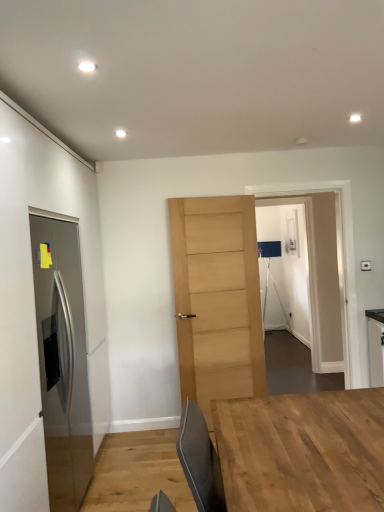
Locate an element on the screen. This screenshot has width=384, height=512. stainless steel door at left, positioned as the 2th door in right-to-left order is located at coordinates (62, 361).

Describe the element at coordinates (62, 361) in the screenshot. I see `stainless steel door at left, positioned as the 2th door in right-to-left order` at that location.

I want to click on transparent glass door at center, marked as the 1th glass door in a back-to-front arrangement, so click(x=286, y=269).

Locate an element on the screen. Image resolution: width=384 pixels, height=512 pixels. light wood door at center, the 2th door when ordered from front to back is located at coordinates (217, 298).

This screenshot has width=384, height=512. I want to click on transparent glass door at center, acting as the 1th glass door starting from the front, so click(324, 278).

Locate an element on the screen. Image resolution: width=384 pixels, height=512 pixels. natural wood table at center is located at coordinates (302, 451).

From the picture: Considering the positions of objects transparent glass door at center, marked as the second glass door in a back-to-front arrangement, and light wood door at center, the 2th door when ordered from front to back, in the image provided, who is behind, transparent glass door at center, marked as the second glass door in a back-to-front arrangement, or light wood door at center, the 2th door when ordered from front to back,?

transparent glass door at center, marked as the second glass door in a back-to-front arrangement, is more distant.

Is transparent glass door at center, marked as the second glass door in a back-to-front arrangement, positioned with its back to light wood door at center, marked as the 1th door in a right-to-left arrangement?

That's not correct — transparent glass door at center, marked as the second glass door in a back-to-front arrangement, is not looking away from light wood door at center, marked as the 1th door in a right-to-left arrangement.

Is light wood door at center, the 2th door when ordered from front to back, surrounded by transparent glass door at center, marked as the second glass door in a back-to-front arrangement?

No, light wood door at center, the 2th door when ordered from front to back, is not a part of transparent glass door at center, marked as the second glass door in a back-to-front arrangement.

Which is more to the left, natural wood table at center or transparent glass door at center, marked as the 1th glass door in a back-to-front arrangement?

From the viewer's perspective, natural wood table at center appears more on the left side.

Is natural wood table at center spatially inside transparent glass door at center, marked as the 1th glass door in a back-to-front arrangement, or outside of it?

natural wood table at center is not inside transparent glass door at center, marked as the 1th glass door in a back-to-front arrangement, it's outside.

Considering the positions of objects natural wood table at center and transparent glass door at center, acting as the second glass door starting from the front, in the image provided, who is behind, natural wood table at center or transparent glass door at center, acting as the second glass door starting from the front,?

transparent glass door at center, acting as the second glass door starting from the front, is further away from the camera.

Is natural wood table at center not close to transparent glass door at center, marked as the 1th glass door in a back-to-front arrangement?

Yes, natural wood table at center and transparent glass door at center, marked as the 1th glass door in a back-to-front arrangement, are quite far apart.

Which of these two, light wood door at center, which is the 1th door from back to front, or natural wood table at center, is thinner?

light wood door at center, which is the 1th door from back to front.

Is point (182, 401) behind point (330, 500)?

Yes.

Is light wood door at center, which is counted as the 2th door, starting from the left, positioned with its back to natural wood table at center?

No, light wood door at center, which is counted as the 2th door, starting from the left, is not facing the opposite direction of natural wood table at center.

Consider the image. Can you tell me how much stainless steel door at left, arranged as the second door when viewed from the back, and natural wood table at center differ in facing direction?

stainless steel door at left, arranged as the second door when viewed from the back, and natural wood table at center are facing 3.29 degrees away from each other.

From a real-world perspective, is stainless steel door at left, positioned as the 2th door in right-to-left order, located higher than natural wood table at center?

Yes.

Considering the sizes of stainless steel door at left, positioned as the 2th door in right-to-left order, and natural wood table at center in the image, is stainless steel door at left, positioned as the 2th door in right-to-left order, taller or shorter than natural wood table at center?

Considering their sizes, stainless steel door at left, positioned as the 2th door in right-to-left order, has more height than natural wood table at center.

Are stainless steel door at left, positioned as the 2th door in right-to-left order, and natural wood table at center beside each other?

No, stainless steel door at left, positioned as the 2th door in right-to-left order, is not with natural wood table at center.

From the image's perspective, does light wood door at center, which is counted as the 2th door, starting from the left, appear higher than transparent glass door at center, acting as the second glass door starting from the front?

No, from the image's perspective, light wood door at center, which is counted as the 2th door, starting from the left, is not over transparent glass door at center, acting as the second glass door starting from the front.

From a real-world perspective, between light wood door at center, which is counted as the 2th door, starting from the left, and transparent glass door at center, marked as the 1th glass door in a back-to-front arrangement, who is vertically lower?

In real-world perspective, transparent glass door at center, marked as the 1th glass door in a back-to-front arrangement, is lower.

How much distance is there between light wood door at center, which is counted as the 2th door, starting from the left, and transparent glass door at center, acting as the second glass door starting from the front?

light wood door at center, which is counted as the 2th door, starting from the left, is 7.96 feet from transparent glass door at center, acting as the second glass door starting from the front.

Is light wood door at center, which is the 1th door from back to front, not close to transparent glass door at center, acting as the second glass door starting from the front?

Yes, light wood door at center, which is the 1th door from back to front, is far from transparent glass door at center, acting as the second glass door starting from the front.

From the image's perspective, is transparent glass door at center, marked as the 1th glass door in a back-to-front arrangement, located above transparent glass door at center, marked as the second glass door in a back-to-front arrangement?

No, from the image's perspective, transparent glass door at center, marked as the 1th glass door in a back-to-front arrangement, is not above transparent glass door at center, marked as the second glass door in a back-to-front arrangement.

Consider the image. Is transparent glass door at center, marked as the 1th glass door in a back-to-front arrangement, placed right next to transparent glass door at center, acting as the 1th glass door starting from the front?

There is a gap between transparent glass door at center, marked as the 1th glass door in a back-to-front arrangement, and transparent glass door at center, acting as the 1th glass door starting from the front.

Considering the positions of objects transparent glass door at center, marked as the 1th glass door in a back-to-front arrangement, and transparent glass door at center, acting as the 1th glass door starting from the front, in the image provided, who is in front, transparent glass door at center, marked as the 1th glass door in a back-to-front arrangement, or transparent glass door at center, acting as the 1th glass door starting from the front,?

Positioned in front is transparent glass door at center, acting as the 1th glass door starting from the front.

In the image, is natural wood table at center positioned in front of or behind transparent glass door at center, acting as the 1th glass door starting from the front?

Result: Visually, natural wood table at center is located in front of transparent glass door at center, acting as the 1th glass door starting from the front.

Does natural wood table at center have a greater height compared to transparent glass door at center, acting as the 1th glass door starting from the front?

No, natural wood table at center is not taller than transparent glass door at center, acting as the 1th glass door starting from the front.

Are natural wood table at center and transparent glass door at center, acting as the 1th glass door starting from the front, located far from each other?

That's right, there is a large distance between natural wood table at center and transparent glass door at center, acting as the 1th glass door starting from the front.

The height and width of the screenshot is (512, 384). Find the location of `glass door that is the 2nd object located above the natural wood table at center (from the image's perspective)`. glass door that is the 2nd object located above the natural wood table at center (from the image's perspective) is located at coordinates (324, 278).

From a real-world perspective, starting from the transparent glass door at center, marked as the second glass door in a back-to-front arrangement, which door is the 1st one below it? Please provide its 2D coordinates.

[(217, 298)]

Identify the location of table on the left of transparent glass door at center, acting as the second glass door starting from the front. Image resolution: width=384 pixels, height=512 pixels. (302, 451).

Looking at the image, which one is located further to stainless steel door at left, arranged as the second door when viewed from the back, natural wood table at center or transparent glass door at center, marked as the second glass door in a back-to-front arrangement?

transparent glass door at center, marked as the second glass door in a back-to-front arrangement, lies further to stainless steel door at left, arranged as the second door when viewed from the back, than the other object.

Considering their positions, is natural wood table at center positioned closer to light wood door at center, the 2th door when ordered from front to back, than transparent glass door at center, acting as the second glass door starting from the front?

natural wood table at center is positioned closer to the anchor light wood door at center, the 2th door when ordered from front to back.

When comparing their distances from stainless steel door at left, arranged as the second door when viewed from the back, does transparent glass door at center, acting as the second glass door starting from the front, or natural wood table at center seem closer?

natural wood table at center is closer to stainless steel door at left, arranged as the second door when viewed from the back.

Looking at the image, which one is located further to natural wood table at center, stainless steel door at left, arranged as the second door when viewed from the back, or transparent glass door at center, marked as the second glass door in a back-to-front arrangement?

transparent glass door at center, marked as the second glass door in a back-to-front arrangement.

Considering their positions, is natural wood table at center positioned further to light wood door at center, which is the 1th door from back to front, than stainless steel door at left, positioned as the 2th door in right-to-left order?

natural wood table at center is positioned further to the anchor light wood door at center, which is the 1th door from back to front.

From the image, which object appears to be farther from natural wood table at center, transparent glass door at center, acting as the 1th glass door starting from the front, or light wood door at center, the 2th door when ordered from front to back?

Based on the image, transparent glass door at center, acting as the 1th glass door starting from the front, appears to be further to natural wood table at center.

From the image, which object appears to be farther from transparent glass door at center, acting as the second glass door starting from the front, stainless steel door at left, arranged as the second door when viewed from the back, or natural wood table at center?

The object further to transparent glass door at center, acting as the second glass door starting from the front, is natural wood table at center.

When comparing their distances from light wood door at center, which is counted as the 2th door, starting from the left, does transparent glass door at center, acting as the second glass door starting from the front, or natural wood table at center seem further?

transparent glass door at center, acting as the second glass door starting from the front, is positioned further to the anchor light wood door at center, which is counted as the 2th door, starting from the left.

This screenshot has height=512, width=384. I want to click on glass door between stainless steel door at left, positioned as the 2th door in right-to-left order, and transparent glass door at center, marked as the 1th glass door in a back-to-front arrangement, along the z-axis, so click(x=324, y=278).

The image size is (384, 512). In order to click on door between stainless steel door at left, arranged as the second door when viewed from the back, and transparent glass door at center, marked as the 1th glass door in a back-to-front arrangement, from front to back in this screenshot , I will do `click(217, 298)`.

Image resolution: width=384 pixels, height=512 pixels. I want to click on door located between stainless steel door at left, arranged as the second door when viewed from the back, and transparent glass door at center, marked as the second glass door in a back-to-front arrangement, in the left-right direction, so click(x=217, y=298).

Locate an element on the screen. glass door positioned between light wood door at center, marked as the 1th door in a right-to-left arrangement, and transparent glass door at center, acting as the second glass door starting from the front, from near to far is located at coordinates (324, 278).